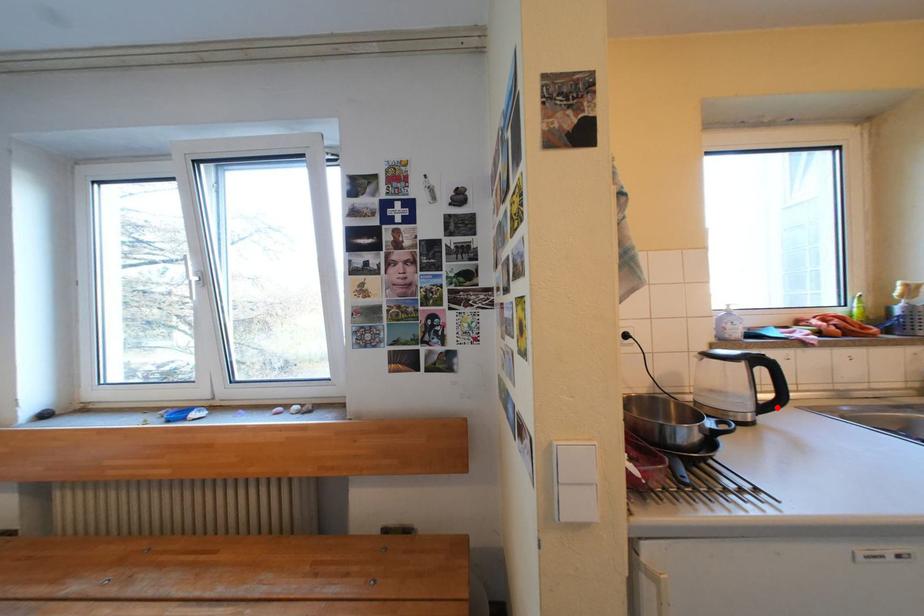
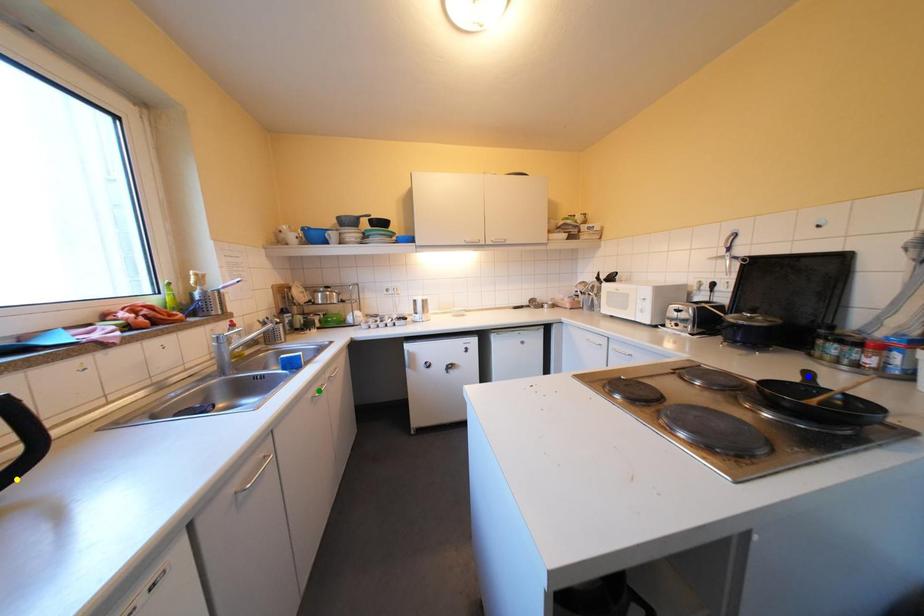
Question: I am providing you with two images of the same scene from different viewpoints. A red point is marked on the first image. You are given multiple points on the second image. Which mark in image 2 goes with the point in image 1?

Choices:
 (A) yellow point
 (B) blue point
 (C) green point

Answer: (A)